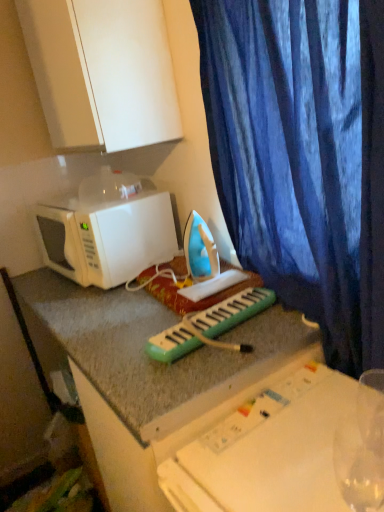
Question: In terms of width, does blue velvet curtain at right look wider or thinner when compared to green plastic musical keyboard at center?

Choices:
 (A) wide
 (B) thin

Answer: (B)

Question: Is blue velvet curtain at right spatially inside green plastic musical keyboard at center, or outside of it?

Choices:
 (A) inside
 (B) outside

Answer: (B)

Question: Which is nearer to the blue velvet curtain at right?

Choices:
 (A) white matte microwave at left
 (B) white glossy cabinet at upper left
 (C) white plastic table at center
 (D) green plastic musical keyboard at center

Answer: (D)

Question: Based on their relative distances, which object is nearer to the white matte microwave at left?

Choices:
 (A) blue velvet curtain at right
 (B) white glossy cabinet at upper left
 (C) white plastic table at center
 (D) green plastic musical keyboard at center

Answer: (B)